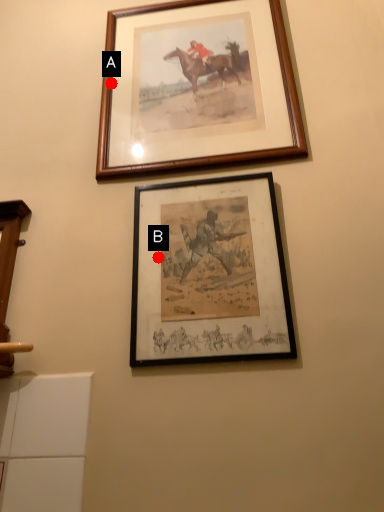
Question: Two points are circled on the image, labeled by A and B beside each circle. Among these points, which one is farthest from the camera?

Choices:
 (A) A is further
 (B) B is further

Answer: (A)